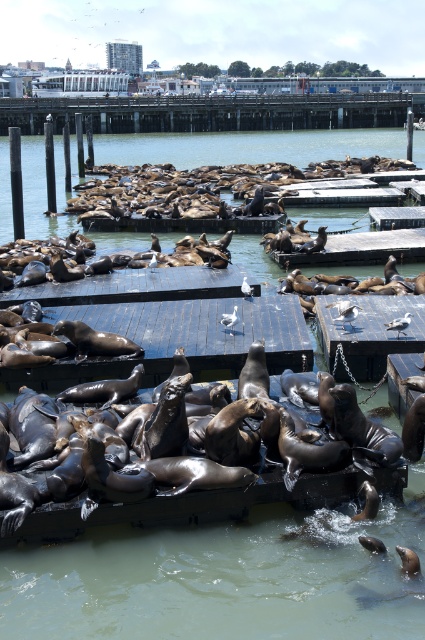
Between wooden dock at center and black wood dock at center, which one appears on the right side from the viewer's perspective?

wooden dock at center

Is wooden dock at center above black wood dock at center?

Incorrect, wooden dock at center is not positioned above black wood dock at center.

Is point (67, 305) farther from camera compared to point (116, 272)?

No, (67, 305) is closer to viewer.

The width and height of the screenshot is (425, 640). What are the coordinates of `wooden dock at center` in the screenshot? It's located at (180, 339).

Is point (22, 132) behind point (175, 268)?

Yes, it is behind point (175, 268).

Is smooth wooden dock at upper center bigger than black wood dock at center?

Correct, smooth wooden dock at upper center is larger in size than black wood dock at center.

Identify the location of smooth wooden dock at upper center. Image resolution: width=425 pixels, height=640 pixels. (212, 113).

Does wooden dock at center have a lesser width compared to smooth wooden dock at upper center?

Yes.

Between point (119, 365) and point (356, 100), which one is positioned behind?

The point (356, 100) is more distant.

This screenshot has height=640, width=425. What are the coordinates of `wooden dock at center` in the screenshot? It's located at (180, 339).